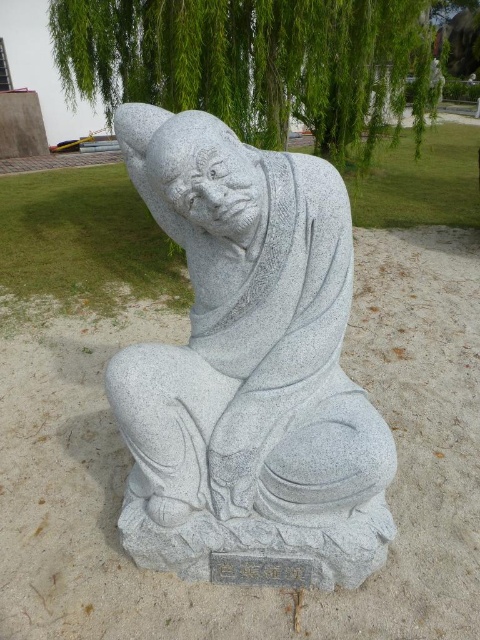
Can you confirm if gray stone statue at center is positioned below green leafy tree at upper center?

Correct, gray stone statue at center is located below green leafy tree at upper center.

Is gray stone statue at center bigger than green leafy tree at upper center?

No.

What do you see at coordinates (249, 365) in the screenshot? I see `gray stone statue at center` at bounding box center [249, 365].

Where is `gray stone statue at center`? The height and width of the screenshot is (640, 480). gray stone statue at center is located at coordinates (249, 365).